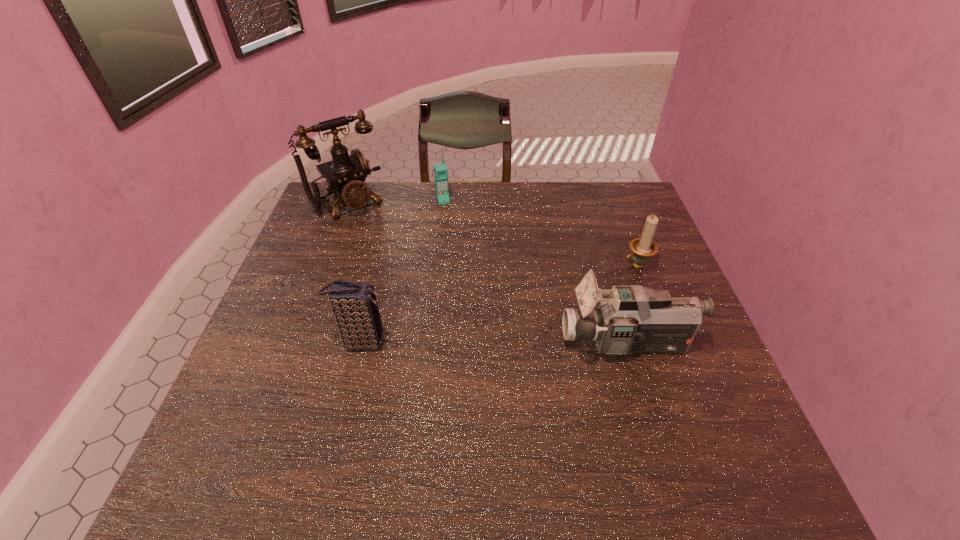
Image resolution: width=960 pixels, height=540 pixels. What are the coordinates of `free space on the desktop that is between the clutch bag and the camcorder and is positioned on the handle side of the third farthest object` in the screenshot? It's located at (468, 343).

The image size is (960, 540). Identify the location of vacant space on the desktop that is between the clutch bag and the camcorder and is positioned on the keypad of the cellular telephone. (492, 343).

The image size is (960, 540). Identify the location of free space on the desktop that is between the clutch bag and the camcorder and is positioned on the rotary dial of the tallest object. (469, 343).